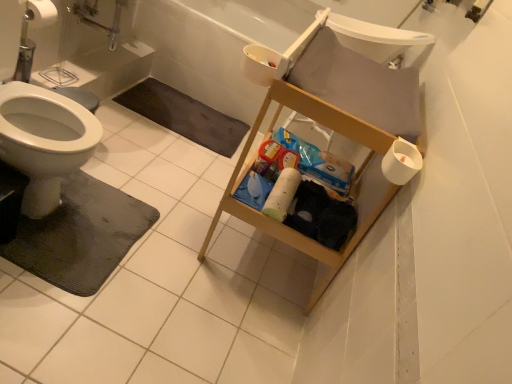
This screenshot has width=512, height=384. What are the coordinates of `free space to the back side of black rubber bath mat at lower left, which is counted as the second bath mat, starting from the top` in the screenshot? It's located at pos(152,169).